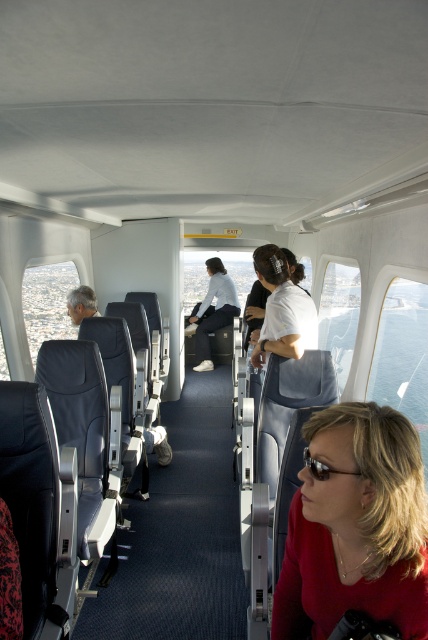
Consider the image. You are a flight attendant standing at the exit door. You need to hand a safety pamphlet to the passenger wearing the matte red shirt at lower right. The aisle is 24 inches wide. Can you reach them without moving out of your current position?

The distance between you and the passenger wearing the matte red shirt at lower right is 35.83 inches. Since the aisle is only 24 inches wide, you would need to step into the aisle to reach them, as 35.83 inches exceeds the aisle width. Therefore, you cannot reach them without moving.

What are the coordinates of the matte red shirt at lower right in the image?

The coordinates of the matte red shirt at lower right are at point (356,525).